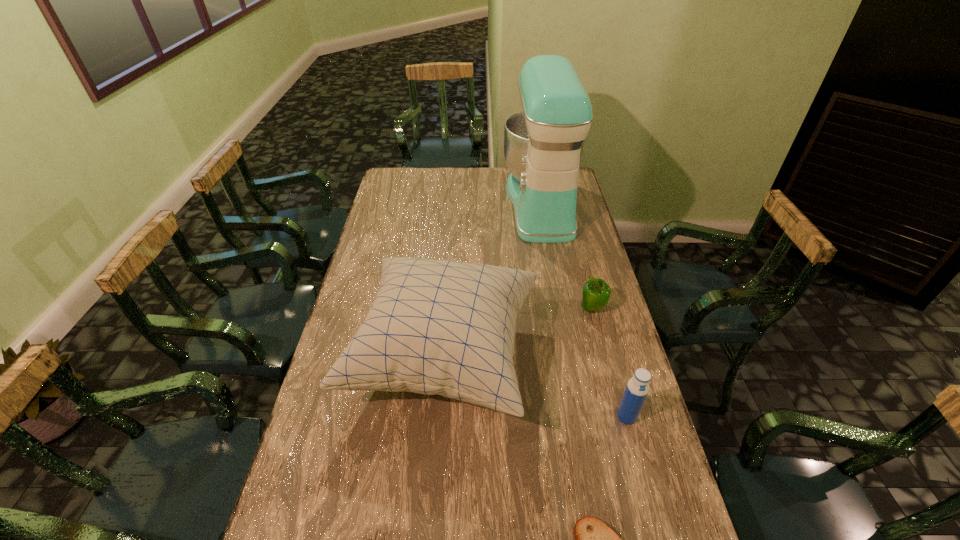
Locate an element on the screen. This screenshot has height=540, width=960. free space located 0.310m on the front of the fourth tallest object is located at coordinates (615, 399).

The image size is (960, 540). Find the location of `object that is positioned at the far edge`. object that is positioned at the far edge is located at coordinates (543, 144).

At what (x,y) coordinates should I click in order to perform the action: click on object that is at the left edge. Please return your answer as a coordinate pair (x, y). Looking at the image, I should click on 444,327.

This screenshot has width=960, height=540. I want to click on mixer situated at the right edge, so click(543, 144).

Identify the location of water bottle that is at the right edge. (637, 388).

The width and height of the screenshot is (960, 540). I want to click on bell pepper present at the right edge, so click(596, 293).

The height and width of the screenshot is (540, 960). I want to click on object located at the far right corner, so click(x=543, y=144).

Where is `vacant space at the far edge`? vacant space at the far edge is located at coordinates (437, 181).

You are a GUI agent. You are given a task and a screenshot of the screen. Output one action in this format:
    pyautogui.click(x=<x>, y=<y>)
    Task: Click on the free space at the left edge
    Image resolution: width=960 pixels, height=540 pixels.
    Given the screenshot: What is the action you would take?
    pyautogui.click(x=336, y=503)

At what (x,y) coordinates should I click in order to perform the action: click on free space at the right edge of the desktop. Please return your answer as a coordinate pair (x, y). Looking at the image, I should click on point(622,354).